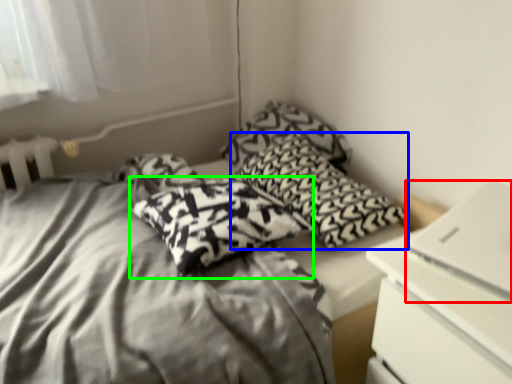
Question: Which object is the farthest from computer (highlighted by a red box)? Choose among these: pillow (highlighted by a blue box) or pillow (highlighted by a green box).

Choices:
 (A) pillow
 (B) pillow

Answer: (B)